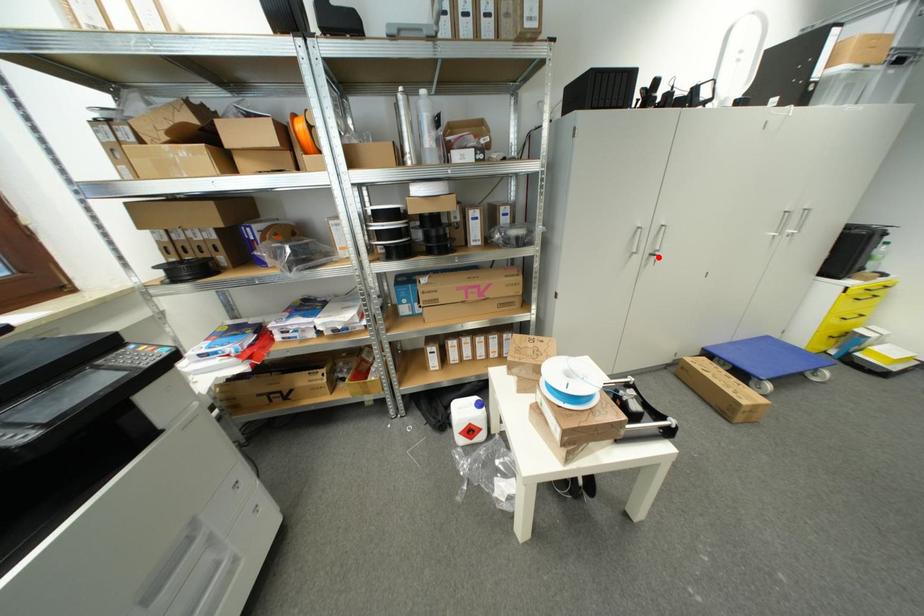
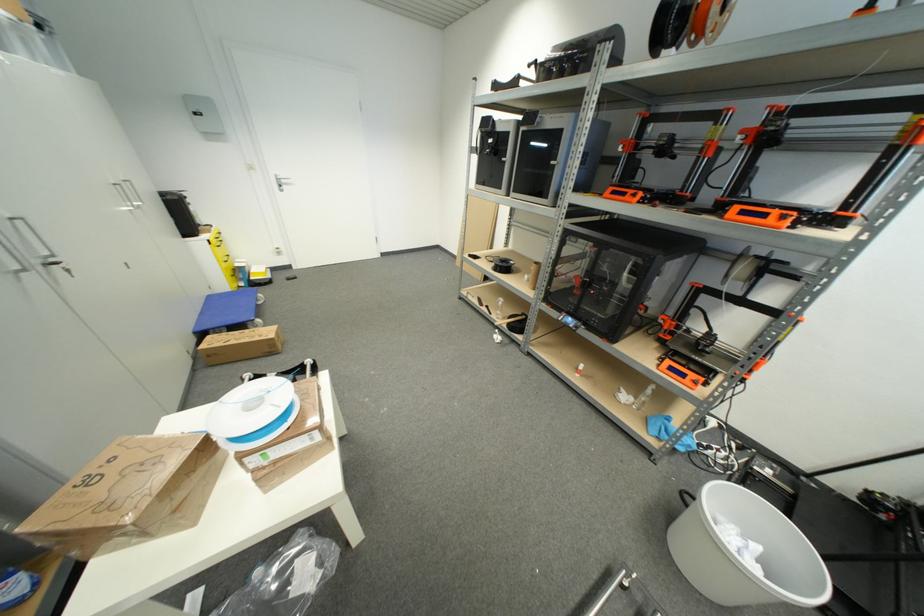
Question: I am providing you with two images of the same scene from different viewpoints. Given a red point in image1, look at the same physical point in image2. Is it:

Choices:
 (A) Closer to the viewpoint
 (B) Farther from the viewpoint

Answer: (B)